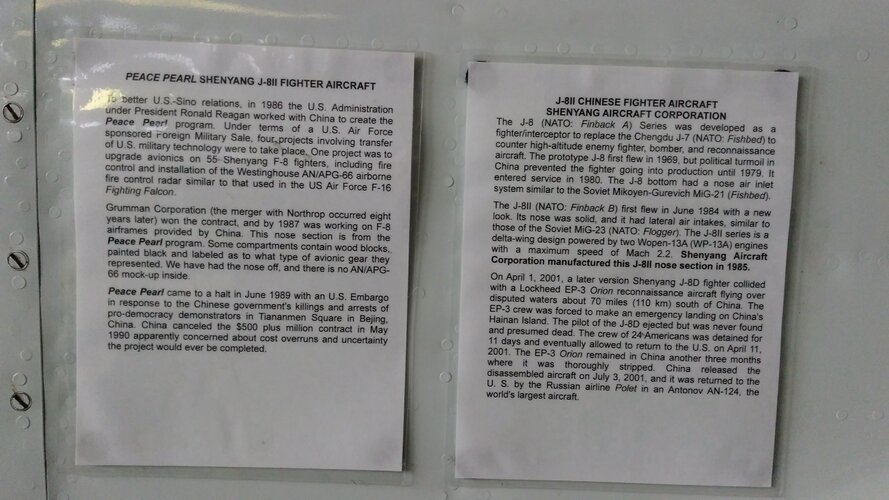
What are the coordinates of `the left bar` in the screenshot? It's located at (20, 448).